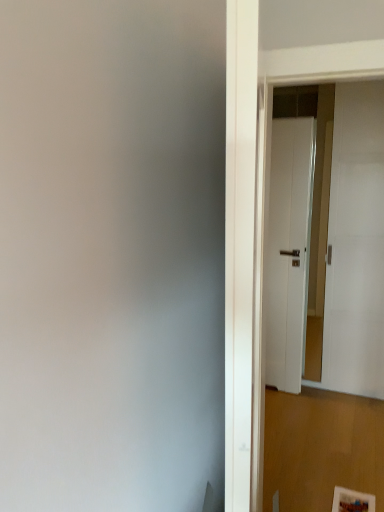
Question: Does white matte door at upper right, the 2th door when ordered from left to right, appear on the right side of white matte door at right, which is the 2th door in right-to-left order?

Choices:
 (A) yes
 (B) no

Answer: (A)

Question: Is white matte door at upper right, the 2th door when ordered from left to right, facing away from white matte door at right, which is the 2th door in right-to-left order?

Choices:
 (A) yes
 (B) no

Answer: (B)

Question: Is white matte door at upper right, the 2th door when ordered from left to right, in front of white matte door at right, which is the 2th door in right-to-left order?

Choices:
 (A) yes
 (B) no

Answer: (A)

Question: From a real-world perspective, is white matte door at upper right, which is the first door from right to left, under white matte door at right, which is the 2th door in right-to-left order?

Choices:
 (A) yes
 (B) no

Answer: (B)

Question: Is white matte door at upper right, which is the first door from right to left, smaller than white matte door at right, which is the 2th door in right-to-left order?

Choices:
 (A) no
 (B) yes

Answer: (A)

Question: Are white matte door at upper right, the 2th door when ordered from left to right, and white matte door at right, which is the 2th door in right-to-left order, making contact?

Choices:
 (A) yes
 (B) no

Answer: (B)

Question: Does white matte door at right, which is the 2th door in right-to-left order, have a lesser height compared to white matte door at upper right, which is the first door from right to left?

Choices:
 (A) yes
 (B) no

Answer: (A)

Question: Does white matte door at right, which is the 2th door in right-to-left order, have a smaller size compared to white matte door at upper right, which is the first door from right to left?

Choices:
 (A) yes
 (B) no

Answer: (A)

Question: Can you confirm if white matte door at right, placed as the first door when sorted from left to right, is wider than white matte door at upper right, the 2th door when ordered from left to right?

Choices:
 (A) yes
 (B) no

Answer: (B)

Question: Is white matte door at right, which is the 2th door in right-to-left order, not close to white matte door at upper right, which is the first door from right to left?

Choices:
 (A) no
 (B) yes

Answer: (A)

Question: From the image's perspective, does white matte door at right, which is the 2th door in right-to-left order, appear lower than white matte door at upper right, the 2th door when ordered from left to right?

Choices:
 (A) yes
 (B) no

Answer: (A)

Question: Does white matte door at right, which is the 2th door in right-to-left order, have a greater height compared to white matte door at upper right, which is the first door from right to left?

Choices:
 (A) no
 (B) yes

Answer: (A)

Question: Visually, is white matte door at right, which is the 2th door in right-to-left order, positioned to the left or to the right of white matte door at upper right, which is the first door from right to left?

Choices:
 (A) left
 (B) right

Answer: (A)